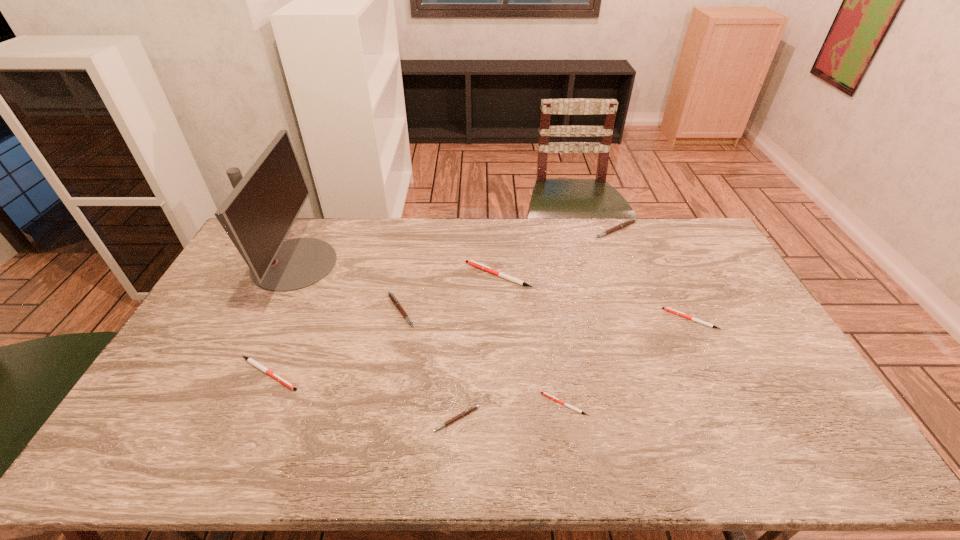
Locate an element on the screen. object that is the fifth closest to the biggest pink pen is located at coordinates (466, 412).

Identify which pen is the second nearest to the biggest pink pen. Please provide its 2D coordinates. Your answer should be formatted as a tuple, i.e. [(x, y)], where the tuple contains the x and y coordinates of a point satisfying the conditions above.

[(667, 309)]

Locate an element on the screen. pen that can be found as the closest to the third nearest white pen is located at coordinates (631, 221).

Identify the location of the closest pink pen to the tallest object. (393, 298).

I want to click on pink pen that stands as the second closest to the farthest pen, so click(466, 412).

Locate an element on the screen. The width and height of the screenshot is (960, 540). the third closest white pen to the leftmost pink pen is located at coordinates (543, 393).

Select which white pen is the closest to the second pink pen from left to right. Please provide its 2D coordinates. Your answer should be formatted as a tuple, i.e. [(x, y)], where the tuple contains the x and y coordinates of a point satisfying the conditions above.

[(543, 393)]

This screenshot has width=960, height=540. I want to click on blank space that satisfies the following two spatial constraints: 1. at the nib of the rightmost pink pen; 2. on the clicker of the leftmost white pen, so click(670, 374).

Image resolution: width=960 pixels, height=540 pixels. I want to click on free spot that satisfies the following two spatial constraints: 1. at the nib of the farthest pink pen; 2. at the nib of the sixth object from right to left, so click(x=646, y=310).